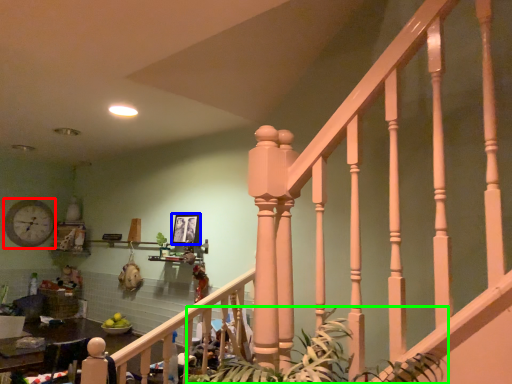
Question: Based on their relative distances, which object is nearer to clock (highlighted by a red box)? Choose from picture frame (highlighted by a blue box) and plant (highlighted by a green box).

Choices:
 (A) picture frame
 (B) plant

Answer: (A)